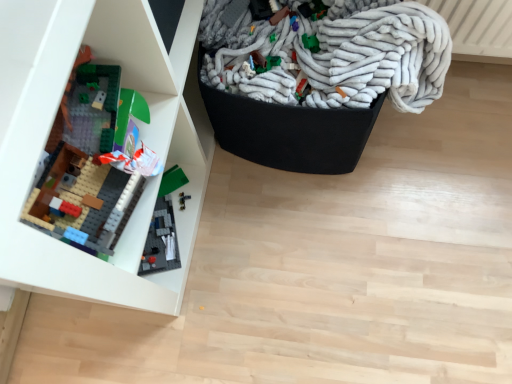
This screenshot has height=384, width=512. Identify the location of free space in front of matte plastic lego set at left. (200, 322).